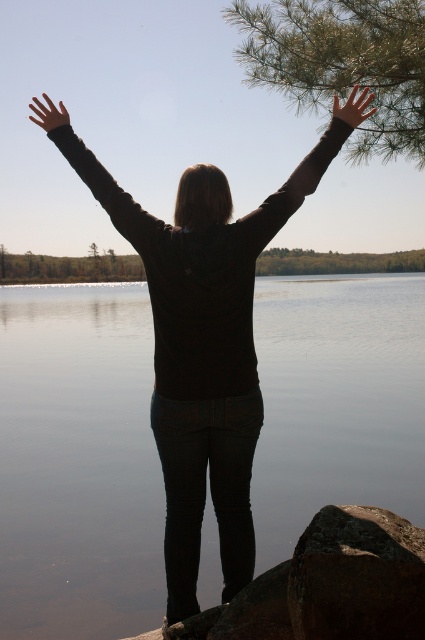
Can you confirm if rough textured rock at lower right is thinner than black matte arm at upper center?

Correct, rough textured rock at lower right's width is less than black matte arm at upper center's.

Describe the element at coordinates (357, 577) in the screenshot. I see `rough textured rock at lower right` at that location.

Which is in front, point (362, 572) or point (124, 205)?

Point (362, 572) is in front.

Where is `rough textured rock at lower right`? rough textured rock at lower right is located at coordinates (357, 577).

Which is more to the left, matte black hand at upper right or black matte hand at upper left?

black matte hand at upper left

Is point (370, 109) positioned after point (45, 100)?

No, it is not.

This screenshot has width=425, height=640. What do you see at coordinates (353, 108) in the screenshot?
I see `matte black hand at upper right` at bounding box center [353, 108].

Where is `matte black hand at upper right`? matte black hand at upper right is located at coordinates (353, 108).

Is point (56, 141) closer to camera compared to point (294, 182)?

No, (56, 141) is behind (294, 182).

The width and height of the screenshot is (425, 640). In order to click on black matte arm at upper center in this screenshot , I will do `click(93, 173)`.